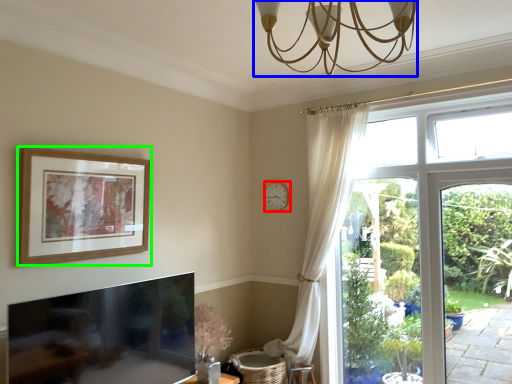
Question: Which is farther away from clock (highlighted by a red box)? light fixture (highlighted by a blue box) or picture frame (highlighted by a green box)?

Choices:
 (A) light fixture
 (B) picture frame

Answer: (A)